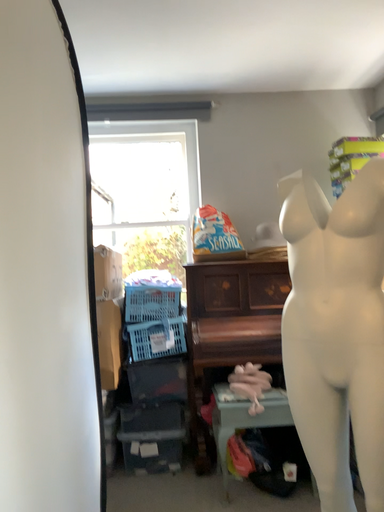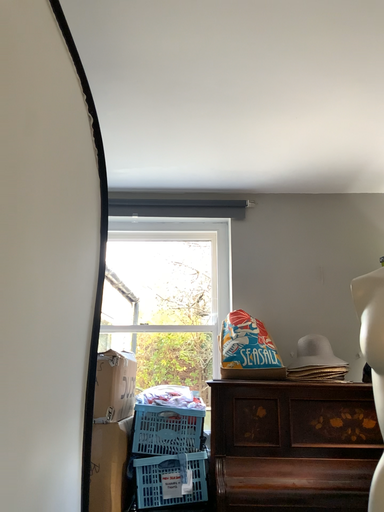
Question: Which way did the camera rotate in the video?

Choices:
 (A) rotated downward
 (B) rotated upward

Answer: (B)